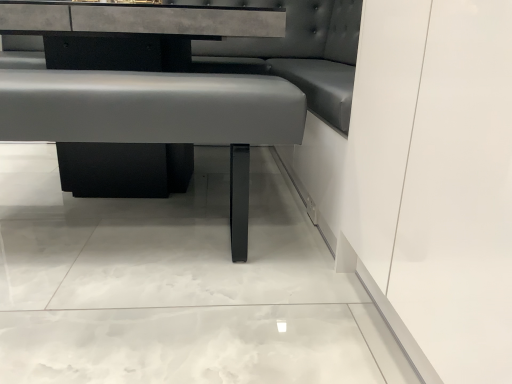
Describe the element at coordinates (131, 33) in the screenshot. I see `satin black table at center` at that location.

Where is `satin black table at center`? The height and width of the screenshot is (384, 512). satin black table at center is located at coordinates (131, 33).

What do you see at coordinates (157, 115) in the screenshot?
I see `matte gray cushion at center` at bounding box center [157, 115].

You are a GUI agent. You are given a task and a screenshot of the screen. Output one action in this format:
    pyautogui.click(x=<x>, y=<y>)
    Task: Click on the matte gray cushion at center
    This screenshot has width=512, height=384.
    Given the screenshot: What is the action you would take?
    pyautogui.click(x=157, y=115)

Identify the location of satin black table at center. The height and width of the screenshot is (384, 512). (131, 33).

Considering the relative positions of matte gray cushion at center and satin black table at center in the image provided, is matte gray cushion at center to the right of satin black table at center from the viewer's perspective?

Indeed, matte gray cushion at center is positioned on the right side of satin black table at center.

Who is more distant, matte gray cushion at center or satin black table at center?

satin black table at center is behind.

Between point (140, 80) and point (134, 7), which one is positioned behind?

The point (134, 7) is behind.

From the image's perspective, which object appears higher, matte gray cushion at center or satin black table at center?

From the image's view, satin black table at center is above.

From a real-world perspective, is matte gray cushion at center on top of satin black table at center?

No, from a real-world perspective, matte gray cushion at center is not on top of satin black table at center.

Is matte gray cushion at center wider than satin black table at center?

In fact, matte gray cushion at center might be narrower than satin black table at center.

Can you confirm if matte gray cushion at center is shorter than satin black table at center?

Yes, matte gray cushion at center is shorter than satin black table at center.

Which of these two, matte gray cushion at center or satin black table at center, is smaller?

Smaller between the two is matte gray cushion at center.

Is matte gray cushion at center not inside satin black table at center?

No.

Is there a large distance between matte gray cushion at center and satin black table at center?

No, matte gray cushion at center is in close proximity to satin black table at center.

Is matte gray cushion at center facing towards satin black table at center?

Yes, matte gray cushion at center is oriented towards satin black table at center.

How far apart are matte gray cushion at center and satin black table at center?

matte gray cushion at center is 11.60 inches from satin black table at center.

This screenshot has width=512, height=384. Identify the location of table above the matte gray cushion at center (from the image's perspective). (131, 33).

Is satin black table at center at the right side of matte gray cushion at center?

No.

In the image, is satin black table at center positioned in front of or behind matte gray cushion at center?

satin black table at center is positioned farther from the viewer than matte gray cushion at center.

Is point (45, 12) more distant than point (71, 96)?

Yes.

In the scene shown: From the image's perspective, between satin black table at center and matte gray cushion at center, which one is located above?

From the image's view, satin black table at center is above.

From a real-world perspective, is satin black table at center positioned above or below matte gray cushion at center?

From a real-world perspective, satin black table at center is physically above matte gray cushion at center.

Is satin black table at center wider than matte gray cushion at center?

Correct, the width of satin black table at center exceeds that of matte gray cushion at center.

Does satin black table at center have a greater height compared to matte gray cushion at center?

Yes.

Is satin black table at center smaller than matte gray cushion at center?

No.

Do you think satin black table at center is within matte gray cushion at center, or outside of it?

satin black table at center cannot be found inside matte gray cushion at center.

Is satin black table at center placed right next to matte gray cushion at center?

No.

Does satin black table at center turn towards matte gray cushion at center?

Yes.

This screenshot has width=512, height=384. Find the location of `vanity below the satin black table at center (from a real-world perspective)`. vanity below the satin black table at center (from a real-world perspective) is located at coordinates (157, 115).

You are a GUI agent. You are given a task and a screenshot of the screen. Output one action in this format:
    pyautogui.click(x=<x>, y=<y>)
    Task: Click on the vanity below the satin black table at center (from the image's perspective)
    The width and height of the screenshot is (512, 384).
    Given the screenshot: What is the action you would take?
    pyautogui.click(x=157, y=115)

Find the location of a particular element. vanity on the right of the satin black table at center is located at coordinates (157, 115).